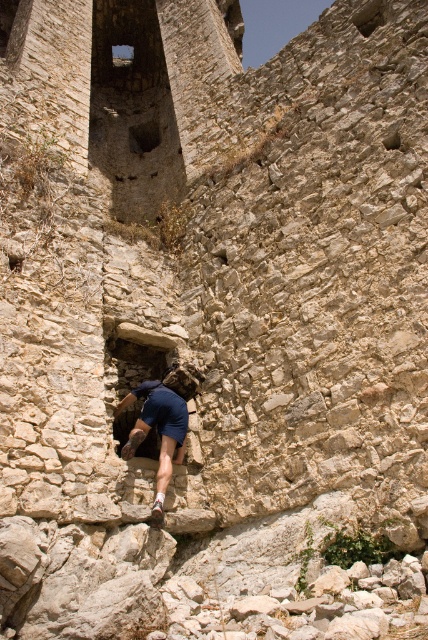
You are standing at the base of the ancient stone wall and see two points marked on the wall. Which point is closer to you, point (139, 362) or point (130, 136)?

Point (139, 362) is closer to the viewer than point (130, 136).

You are a rock climber attempting to ascend the ancient stone wall. You notice two holes to place your hands and feet. The stone hole at center and the dark stone hole at upper center. Which hole should you choose for a better grip?

The stone hole at center is larger in size than the dark stone hole at upper center, so you should choose the stone hole at center for a better grip because it provides more surface area for your hand or foot to grasp securely.

You are a hiker trying to climb through a narrow opening in the ancient stone wall. You notice the dark blue fabric at center and the dark stone hole at upper center. Which object is located to the right of the other?

The dark blue fabric at center is positioned on the right side of dark stone hole at upper center, so the dark blue fabric at center is to the right of the dark stone hole at upper center.